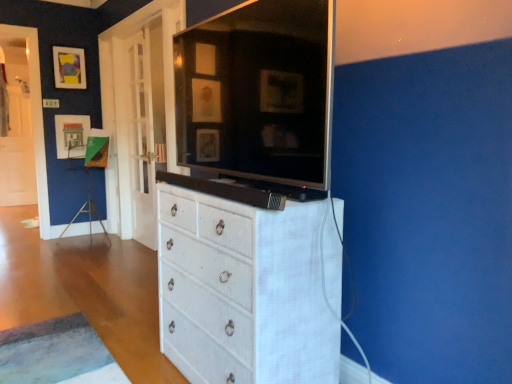
At what (x,y) coordinates should I click in order to perform the action: click on blank space situated above matte paper picture frame at upper left, which is the second picture frame from top to bottom (from a real-world perspective). Please return your answer as a coordinate pair (x, y). Looking at the image, I should click on (70, 115).